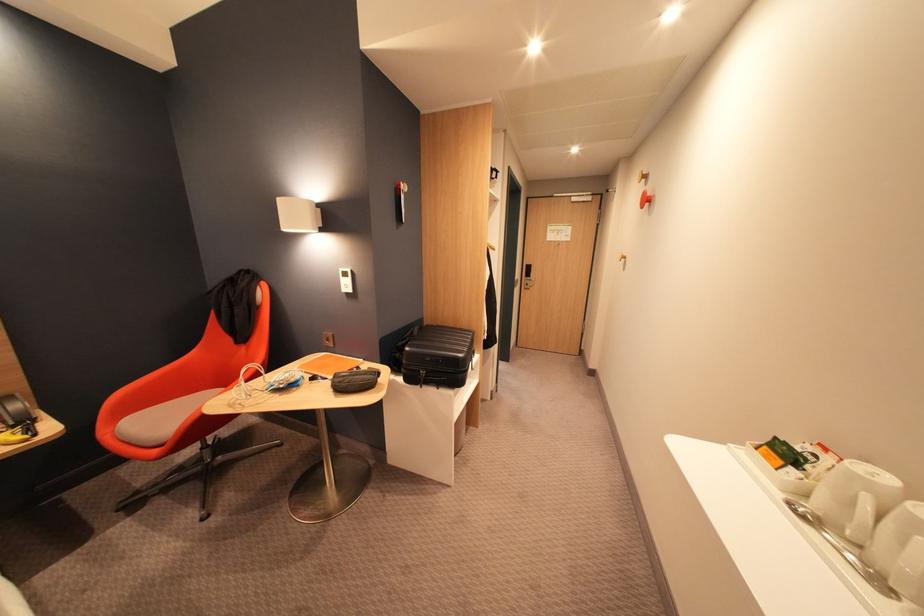
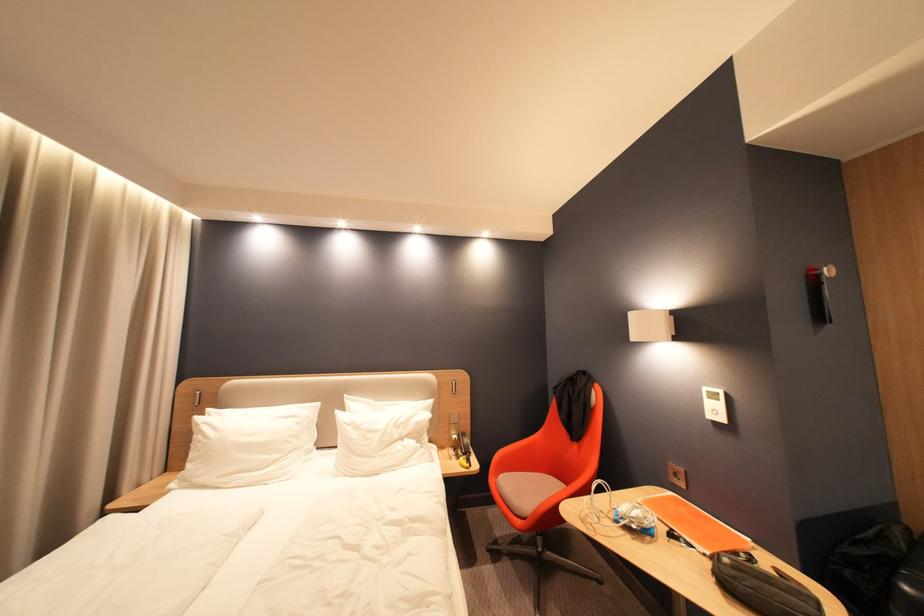
In the second image, find the point that corresponds to the point at 337,341 in the first image.

(686, 476)